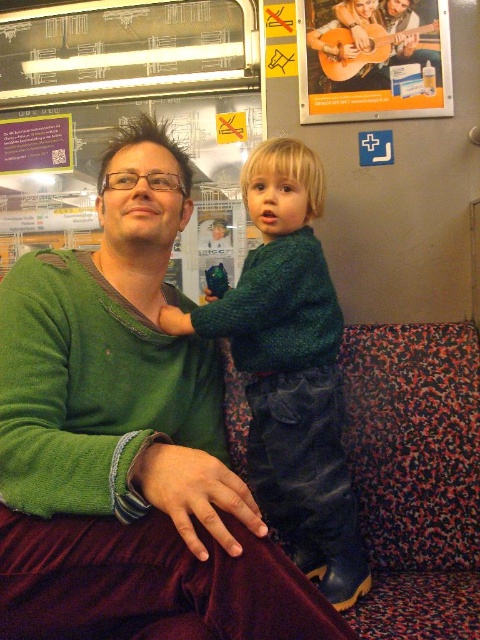
You are standing 5 feet away from the train carriage. If you want to see the point at coordinates point (91, 259) clearly, do you need to move closer or farther away?

The point (91, 259) is currently 3.81 feet away from the viewer. Since you are standing 5 feet away, you need to move closer by approximately 1.19 feet to see it clearly.

You are a passenger on the train and want to place a small bag on the seat. The seat has a coordinate system where the bottom left corner is the origin. The dark green sweater at center is at point 0.577, 0.606. Where should you place the bag to avoid the sweater?

To avoid the dark green sweater at center, place the bag away from the coordinates (x=290, y=369) on the seat.

You are a photographer trying to capture a photo of the green fuzzy sweater at center and the wooden guitar at upper center. Since you want both objects to be clearly visible in the frame, which object should you focus on first to ensure proper depth of field?

The green fuzzy sweater at center is taller than the wooden guitar at upper center, so focusing on the taller object first would help ensure both are in focus.